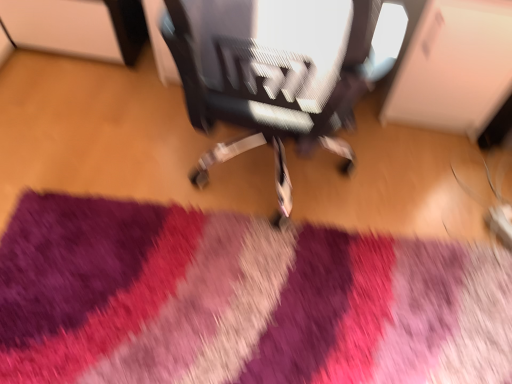
Question: Is purple shaggy rug at center taller or shorter than textured fabric chair at center?

Choices:
 (A) tall
 (B) short

Answer: (B)

Question: From the image's perspective, relative to textured fabric chair at center, is purple shaggy rug at center above or below?

Choices:
 (A) above
 (B) below

Answer: (B)

Question: Is purple shaggy rug at center in front of or behind textured fabric chair at center in the image?

Choices:
 (A) front
 (B) behind

Answer: (B)

Question: Relative to purple shaggy rug at center, is textured fabric chair at center in front or behind?

Choices:
 (A) front
 (B) behind

Answer: (A)

Question: In the image, is textured fabric chair at center on the left side or the right side of purple shaggy rug at center?

Choices:
 (A) left
 (B) right

Answer: (B)

Question: Is textured fabric chair at center spatially inside purple shaggy rug at center, or outside of it?

Choices:
 (A) inside
 (B) outside

Answer: (B)

Question: In terms of size, does textured fabric chair at center appear bigger or smaller than purple shaggy rug at center?

Choices:
 (A) big
 (B) small

Answer: (A)